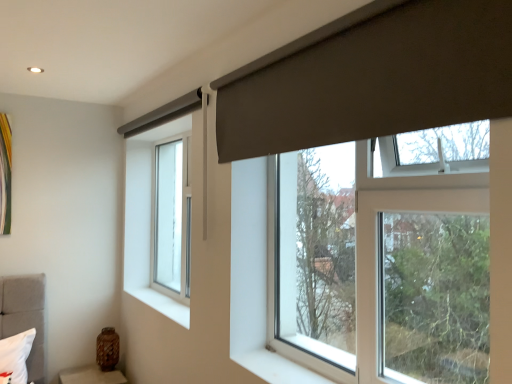
Question: Considering the positions of point (423, 177) and point (176, 309), is point (423, 177) closer or farther from the camera than point (176, 309)?

Choices:
 (A) closer
 (B) farther

Answer: (A)

Question: From a real-world perspective, is transparent glass window at center, acting as the second window starting from the left, positioned above or below white smooth window sill at lower left?

Choices:
 (A) above
 (B) below

Answer: (A)

Question: Estimate the real-world distances between objects in this image. Which object is closer to the brown textured vase at lower left?

Choices:
 (A) matte gray curtain at upper right
 (B) clear glass window at center left, the 2th window positioned from the front
 (C) transparent glass window at center, acting as the second window starting from the left
 (D) white smooth window sill at lower left

Answer: (D)

Question: Estimate the real-world distances between objects in this image. Which object is closer to the matte gray curtain at upper right?

Choices:
 (A) clear glass window at center left, which is the 1th window in left-to-right order
 (B) white smooth window sill at lower left
 (C) transparent glass window at center, which is counted as the first window, starting from the right
 (D) brown textured vase at lower left

Answer: (C)